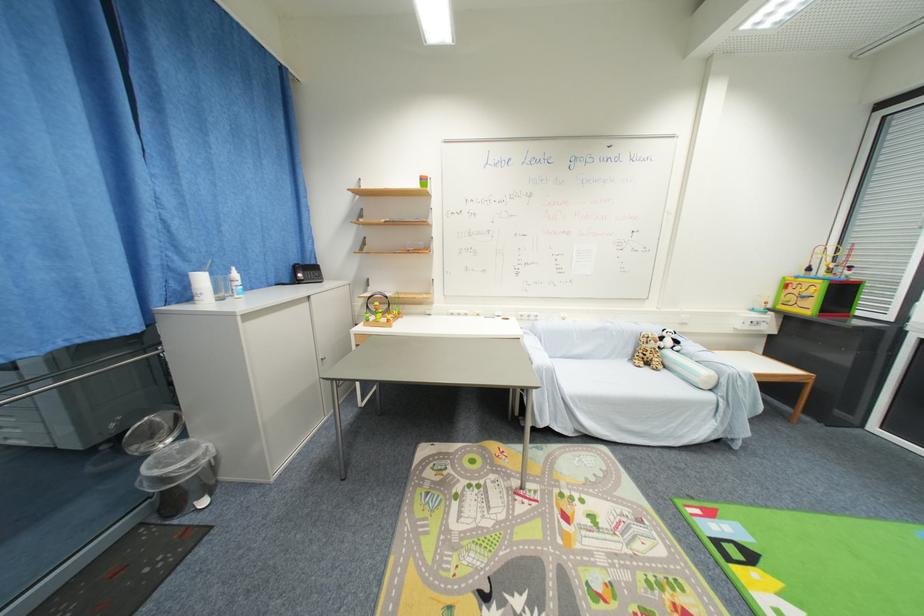
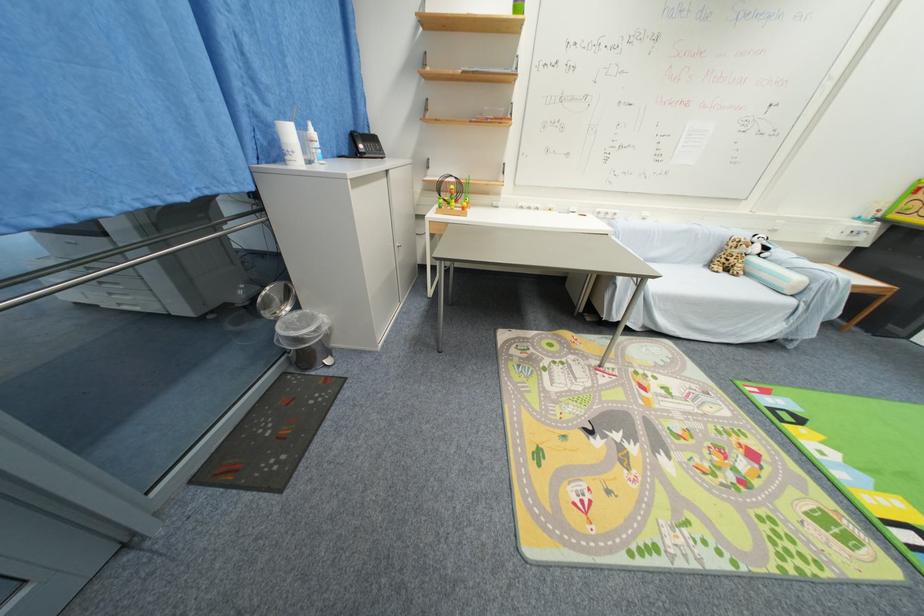
Where in the second image is the point corresponding to (315,276) from the first image?

(377, 148)